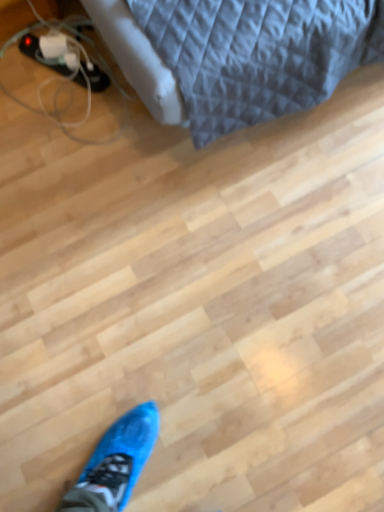
Image resolution: width=384 pixels, height=512 pixels. Identify the location of vacant space in front of matte black shoe at upper left. (72, 118).